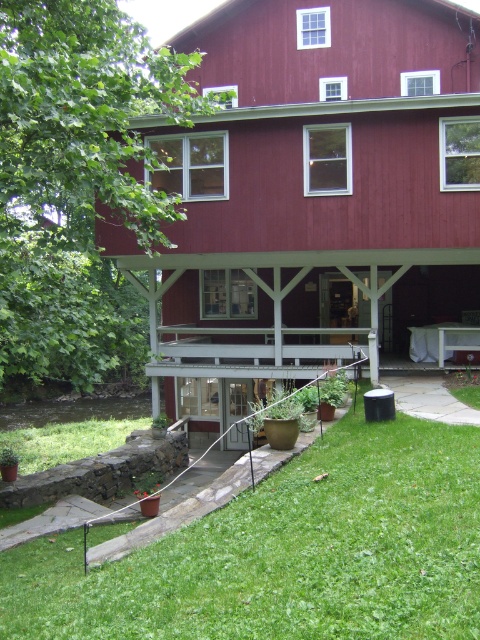
Question: Does smooth red barn at center lie in front of green grass at lower center?

Choices:
 (A) yes
 (B) no

Answer: (B)

Question: Can you confirm if smooth red barn at center is smaller than green grass at lower center?

Choices:
 (A) yes
 (B) no

Answer: (B)

Question: Can you confirm if smooth red barn at center is positioned to the right of green grass at lower center?

Choices:
 (A) no
 (B) yes

Answer: (B)

Question: Which object is farther from the camera taking this photo?

Choices:
 (A) smooth red barn at center
 (B) green grass at lower center

Answer: (A)

Question: Which point appears farthest from the camera in this image?

Choices:
 (A) (214, 275)
 (B) (317, 512)

Answer: (A)